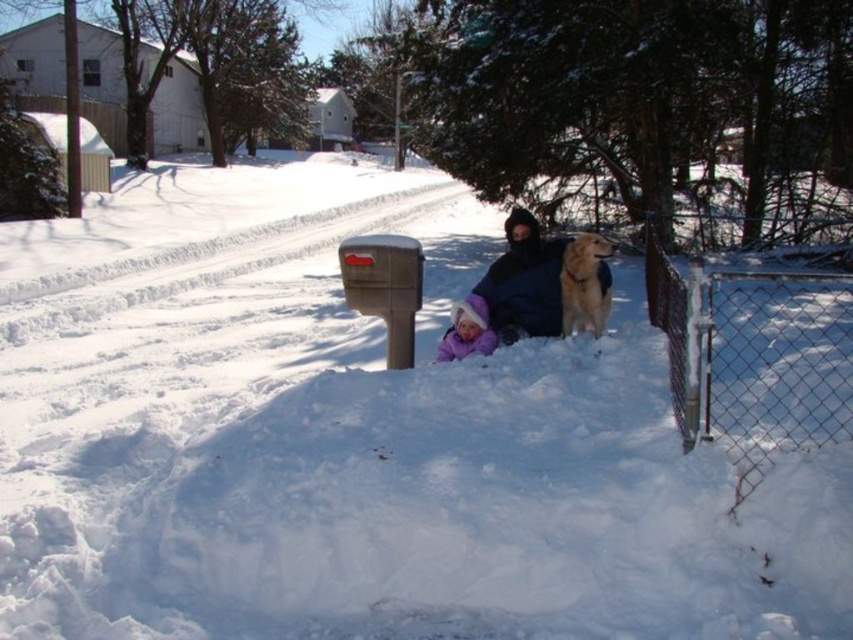
You are standing at the origin point in the image. The dark blue jacket at center is represented by point (x=524, y=282). Can you tell me what direction the dark blue jacket at center is facing relative to your position?

The dark blue jacket at center is facing towards the origin point since it is represented by the coordinates (x=524, y=282).

You are a photographer trying to capture a closeup shot of the golden fur dog at center and the purple fleece hat at lower center in the snowy scene. Your camera can only focus on objects within a 1 meter range. Will both subjects be in focus?

The golden fur dog at center and purple fleece hat at lower center are 98.59 centimeters apart, which is within the 1 meter range, so both subjects will be in focus.

You are a delivery person who needs to place a package between the dark blue jacket at center and the purple fleece hat at lower center. The package is 12 inches long. Can you fit it between them without overlapping either object?

The dark blue jacket at center and purple fleece hat at lower center are 13.58 inches apart. Since the package is 12 inches long, it can fit between them without overlapping either object as there is enough space.